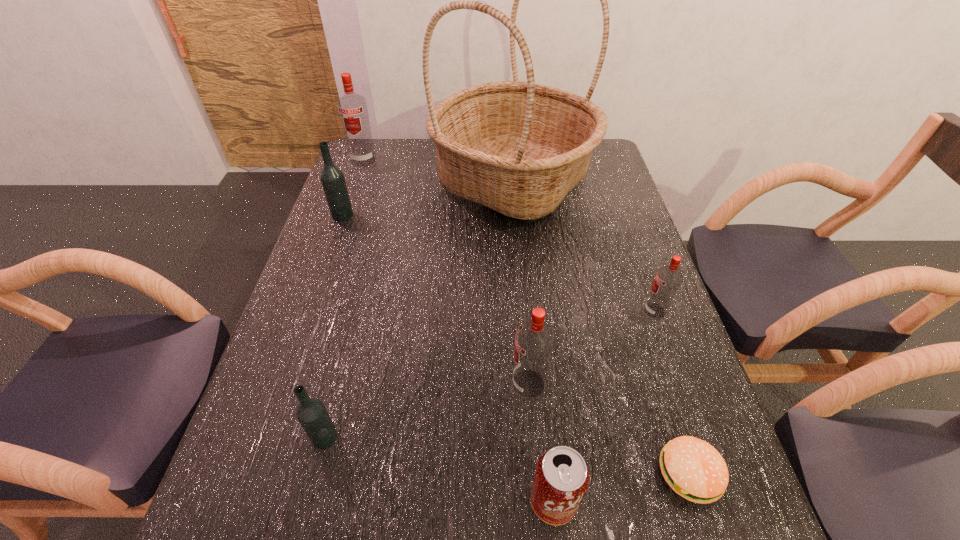
You are a GUI agent. You are given a task and a screenshot of the screen. Output one action in this format:
    pyautogui.click(x=<x>, y=<y>)
    Task: Click on the vacant space that satisfies the following two spatial constraints: 1. on the front label of the smaller black vodka; 2. on the right side of the leftmost red vodka
    
    Given the screenshot: What is the action you would take?
    pyautogui.click(x=269, y=437)